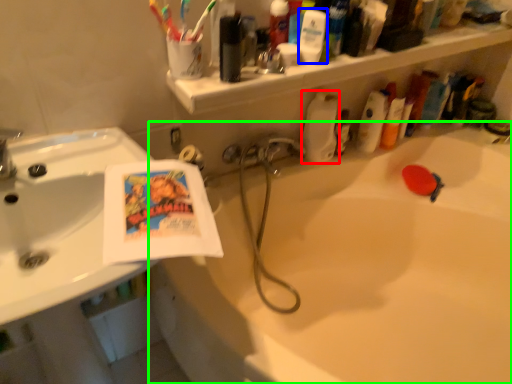
Question: Which is nearer to the cleaning product (highlighted by a red box)? mouthwash (highlighted by a blue box) or bathtub (highlighted by a green box).

Choices:
 (A) mouthwash
 (B) bathtub

Answer: (A)